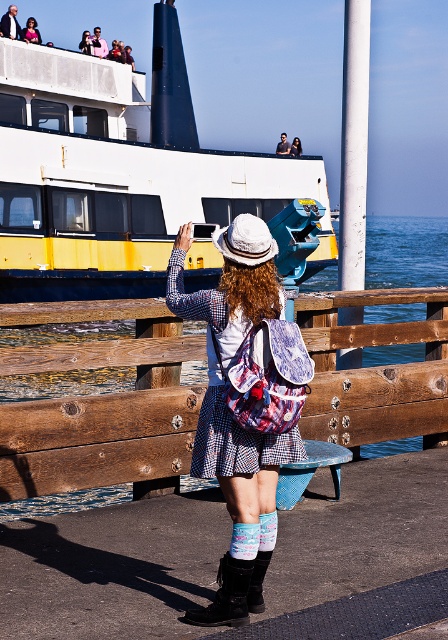
Is black leather boot at lower center taller than leather boot at lower center?

Yes.

The height and width of the screenshot is (640, 448). Identify the location of black leather boot at lower center. point(227,595).

Who is more forward, (235, 596) or (262, 588)?

Point (235, 596)

The image size is (448, 640). I want to click on black leather boot at lower center, so click(227, 595).

Is point (323, 260) closer to viewer compared to point (287, 152)?

Yes, it is in front of point (287, 152).

Looking at this image, is yellow painted metal ferry at upper left below white woven hat at upper center?

Indeed, yellow painted metal ferry at upper left is positioned under white woven hat at upper center.

Describe the element at coordinates (123, 173) in the screenshot. Image resolution: width=448 pixels, height=640 pixels. I see `yellow painted metal ferry at upper left` at that location.

Find the location of a particular element. This screenshot has height=640, width=448. yellow painted metal ferry at upper left is located at coordinates (123, 173).

Describe the element at coordinates (227, 595) in the screenshot. I see `black leather boot at lower center` at that location.

Is black leather boot at lower center further to the viewer compared to white woven hat at upper center?

That is False.

What do you see at coordinates (227, 595) in the screenshot? The width and height of the screenshot is (448, 640). I see `black leather boot at lower center` at bounding box center [227, 595].

Where is `black leather boot at lower center`? This screenshot has width=448, height=640. black leather boot at lower center is located at coordinates (227, 595).